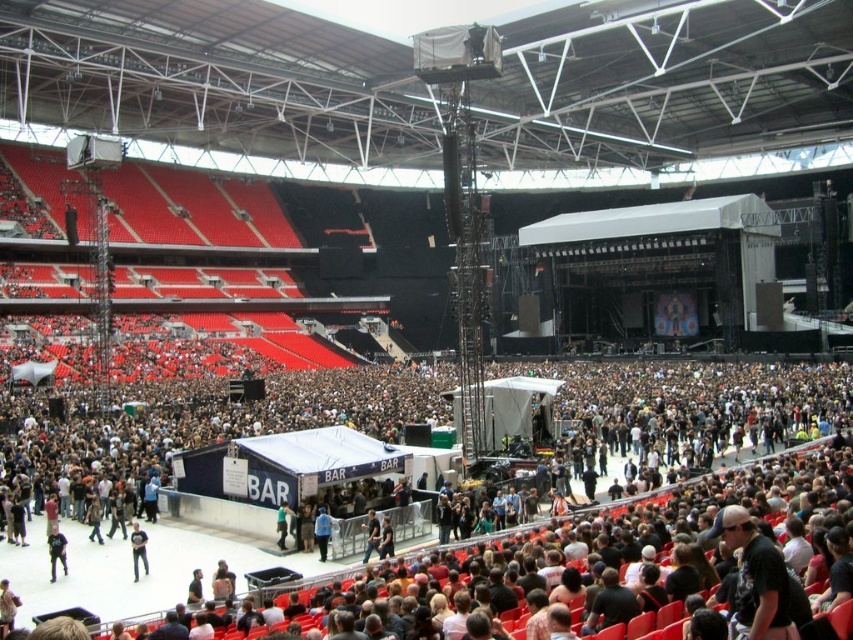
Question: Among these objects, which one is farthest from the camera?

Choices:
 (A) black matte shirt at lower left
 (B) blue fabric jacket at center
 (C) dark gray t-shirt at center

Answer: (B)

Question: Which object is farther from the camera taking this photo?

Choices:
 (A) blue fabric jacket at center
 (B) dark gray t-shirt at center

Answer: (A)

Question: Does black matte shirt at lower left appear on the right side of blue fabric jacket at center?

Choices:
 (A) no
 (B) yes

Answer: (A)

Question: Is black matte shirt at lower left smaller than dark gray t-shirt at center?

Choices:
 (A) no
 (B) yes

Answer: (A)

Question: Can you confirm if blue fabric jacket at center is positioned to the left of dark gray t-shirt at center?

Choices:
 (A) no
 (B) yes

Answer: (A)

Question: Which object is farther from the camera taking this photo?

Choices:
 (A) black matte shirt at lower left
 (B) blue fabric jacket at center
 (C) dark gray t-shirt at center

Answer: (B)